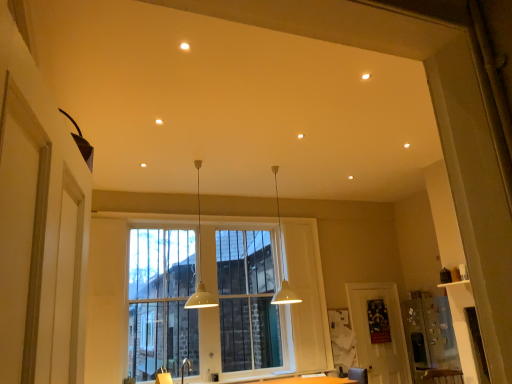
Question: Which is correct: matte white screen door at lower right is inside white matte pendant light at center, the 2th lamp in the right-to-left sequence, or outside of it?

Choices:
 (A) outside
 (B) inside

Answer: (A)

Question: Is point (395, 339) positioned closer to the camera than point (189, 299)?

Choices:
 (A) farther
 (B) closer

Answer: (A)

Question: Which object is positioned farthest from the white matte pendant light at center, the 2th lamp when ordered from left to right?

Choices:
 (A) white matte pendant light at center, the 2th lamp in the right-to-left sequence
 (B) clear glass window at center
 (C) matte white screen door at lower right

Answer: (C)

Question: Which is nearer to the white matte pendant light at center, positioned as the first lamp in right-to-left order?

Choices:
 (A) matte white screen door at lower right
 (B) white matte pendant light at center, the 2th lamp in the right-to-left sequence
 (C) clear glass window at center

Answer: (C)